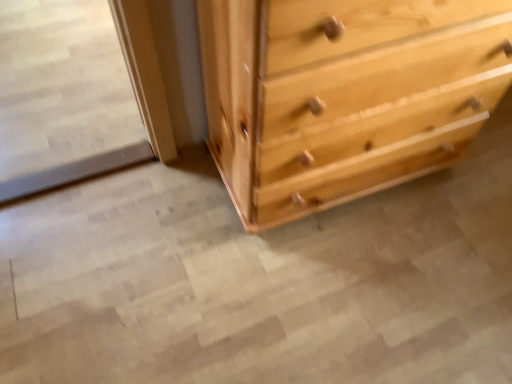
Describe the element at coordinates (344, 95) in the screenshot. The height and width of the screenshot is (384, 512). I see `natural wood chest of drawers at center` at that location.

What are the coordinates of `natural wood chest of drawers at center` in the screenshot? It's located at (344, 95).

Identify the location of clear glass screen door at left. This screenshot has width=512, height=384. (63, 97).

What do you see at coordinates (63, 97) in the screenshot? I see `clear glass screen door at left` at bounding box center [63, 97].

I want to click on natural wood chest of drawers at center, so click(x=344, y=95).

Which is more to the left, natural wood chest of drawers at center or clear glass screen door at left?

From the viewer's perspective, clear glass screen door at left appears more on the left side.

Is natural wood chest of drawers at center in front of or behind clear glass screen door at left in the image?

Visually, natural wood chest of drawers at center is located in front of clear glass screen door at left.

Considering the positions of point (217, 104) and point (79, 18), is point (217, 104) closer or farther from the camera than point (79, 18)?

Point (217, 104) is closer to the camera than point (79, 18).

From the image's perspective, who appears lower, natural wood chest of drawers at center or clear glass screen door at left?

natural wood chest of drawers at center appears lower in the image.

From a real-world perspective, between natural wood chest of drawers at center and clear glass screen door at left, who is vertically higher?

In real-world perspective, natural wood chest of drawers at center is above.

Considering the sizes of natural wood chest of drawers at center and clear glass screen door at left in the image, is natural wood chest of drawers at center wider or thinner than clear glass screen door at left?

Clearly, natural wood chest of drawers at center has less width compared to clear glass screen door at left.

Looking at this image, is natural wood chest of drawers at center taller or shorter than clear glass screen door at left?

In the image, natural wood chest of drawers at center appears to be taller than clear glass screen door at left.

Based on their sizes in the image, would you say natural wood chest of drawers at center is bigger or smaller than clear glass screen door at left?

Clearly, natural wood chest of drawers at center is larger in size than clear glass screen door at left.

Choose the correct answer: Is natural wood chest of drawers at center inside clear glass screen door at left or outside it?

natural wood chest of drawers at center exists outside the volume of clear glass screen door at left.

Based on the photo, is natural wood chest of drawers at center beside clear glass screen door at left?

They are not placed beside each other.

Is natural wood chest of drawers at center facing towards clear glass screen door at left?

No, natural wood chest of drawers at center is not turned towards clear glass screen door at left.

The image size is (512, 384). Find the location of `the chest of drawers in front of the clear glass screen door at left`. the chest of drawers in front of the clear glass screen door at left is located at coordinates (344, 95).

Based on the photo, is clear glass screen door at left at the left side of natural wood chest of drawers at center?

Yes.

Which object is closer to the camera, clear glass screen door at left or natural wood chest of drawers at center?

Positioned in front is natural wood chest of drawers at center.

Which point is more distant from viewer, (40, 126) or (378, 48)?

Positioned behind is point (40, 126).

From the image's perspective, is clear glass screen door at left located above or below natural wood chest of drawers at center?

Clearly, from the image's perspective, clear glass screen door at left is above natural wood chest of drawers at center.

From a real-world perspective, which object stands above the other?

natural wood chest of drawers at center.

In terms of width, does clear glass screen door at left look wider or thinner when compared to natural wood chest of drawers at center?

In the image, clear glass screen door at left appears to be wider than natural wood chest of drawers at center.

Is clear glass screen door at left taller or shorter than natural wood chest of drawers at center?

Clearly, clear glass screen door at left is shorter compared to natural wood chest of drawers at center.

Considering the relative sizes of clear glass screen door at left and natural wood chest of drawers at center in the image provided, is clear glass screen door at left bigger than natural wood chest of drawers at center?

Actually, clear glass screen door at left might be smaller than natural wood chest of drawers at center.

Can natural wood chest of drawers at center be found inside clear glass screen door at left?

No, natural wood chest of drawers at center is not surrounded by clear glass screen door at left.

Is clear glass screen door at left not close to natural wood chest of drawers at center?

Actually, clear glass screen door at left and natural wood chest of drawers at center are a little close together.

Could you tell me if clear glass screen door at left is facing natural wood chest of drawers at center?

No, clear glass screen door at left is not facing towards natural wood chest of drawers at center.

Can you tell me how much clear glass screen door at left and natural wood chest of drawers at center differ in facing direction?

1.28 degrees separate the facing orientations of clear glass screen door at left and natural wood chest of drawers at center.

Measure the distance from clear glass screen door at left to natural wood chest of drawers at center.

clear glass screen door at left is 82.52 centimeters from natural wood chest of drawers at center.

What are the coordinates of `the chest of drawers that is above the clear glass screen door at left (from a real-world perspective)` in the screenshot? It's located at (344, 95).

The image size is (512, 384). I want to click on screen door behind the natural wood chest of drawers at center, so click(x=63, y=97).

Find the location of a particular element. Image resolution: width=512 pixels, height=384 pixels. screen door located underneath the natural wood chest of drawers at center (from a real-world perspective) is located at coordinates (63, 97).